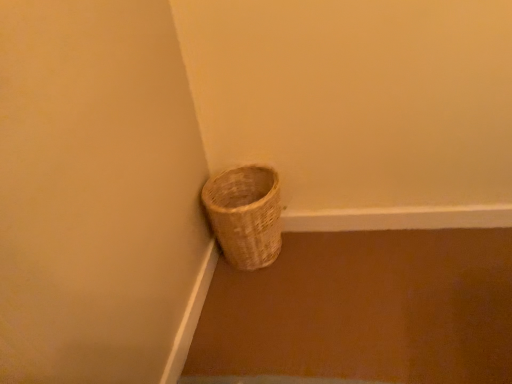
From the picture: Measure the distance between point (225, 241) and camera.

The depth of point (225, 241) is 4.75 feet.

The image size is (512, 384). Describe the element at coordinates (245, 215) in the screenshot. I see `woven beige basket at corner` at that location.

Image resolution: width=512 pixels, height=384 pixels. I want to click on woven beige basket at corner, so click(245, 215).

Identify the location of woven beige basket at corner. Image resolution: width=512 pixels, height=384 pixels. (245, 215).